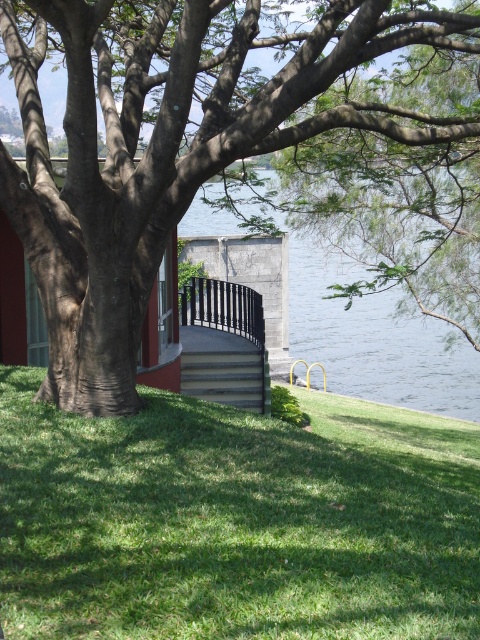
Between green grass at lower center and black metal railing at center, which one is positioned higher?

Positioned higher is black metal railing at center.

Does point (245, 632) lie behind point (223, 300)?

No.

Locate an element on the screen. This screenshot has height=640, width=480. green grass at lower center is located at coordinates (236, 520).

Who is more forward, [176,92] or [218,362]?

Point [176,92] is in front.

Consider the image. Who is higher up, brown rough tree at center or gray concrete stairs at lower center?

brown rough tree at center is higher up.

At what (x,y) coordinates should I click in order to perform the action: click on brown rough tree at center. Please return your answer as a coordinate pair (x, y). This screenshot has height=640, width=480. Looking at the image, I should click on (178, 141).

Does green grass at lower center have a lesser height compared to gray concrete stairs at lower center?

No.

Who is shorter, green grass at lower center or gray concrete stairs at lower center?

gray concrete stairs at lower center

What are the coordinates of `green grass at lower center` in the screenshot? It's located at (236, 520).